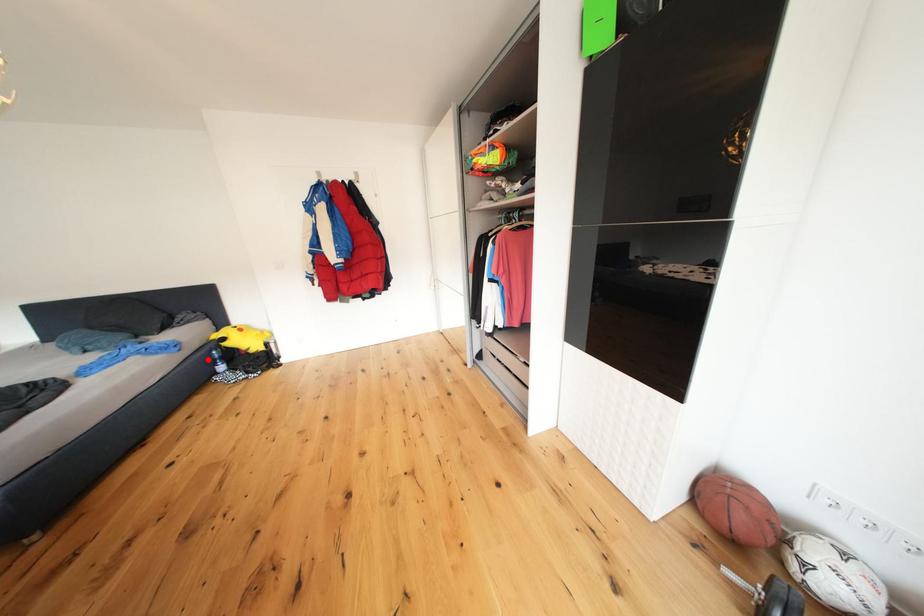
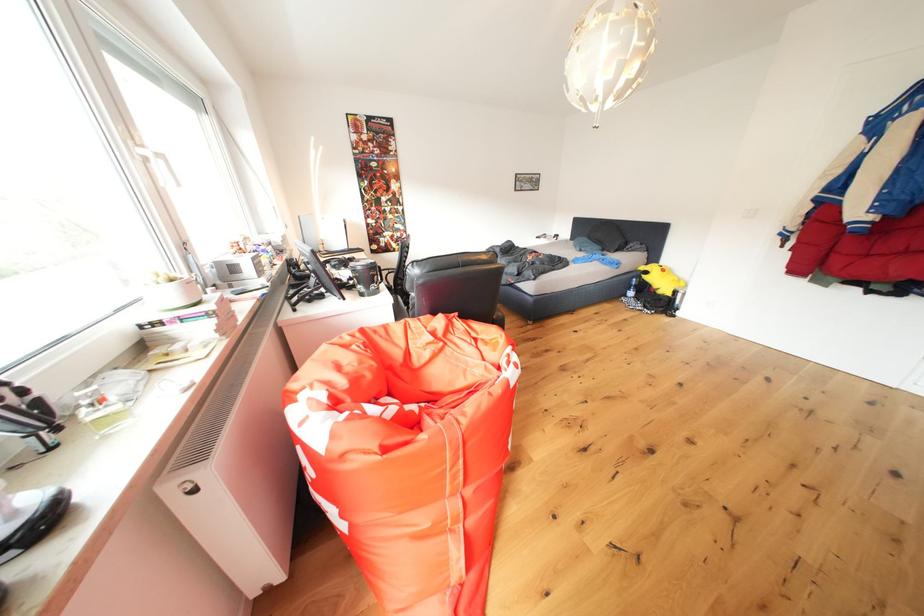
Where in the second image is the point corresponding to the highlighted location from the first image?

(634, 282)